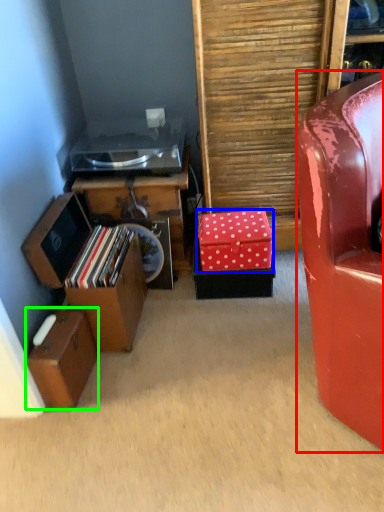
Question: Estimate the real-world distances between objects in this image. Which object is closer to chair (highlighted by a red box), storage box (highlighted by a blue box) or storage box (highlighted by a green box)?

Choices:
 (A) storage box
 (B) storage box

Answer: (A)